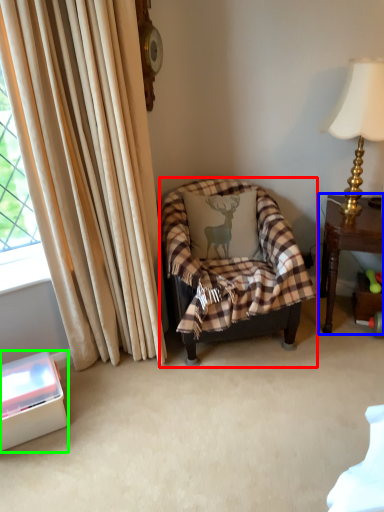
Question: Which object is the farthest from chair (highlighted by a red box)? Choose among these: table (highlighted by a blue box) or box (highlighted by a green box).

Choices:
 (A) table
 (B) box

Answer: (B)